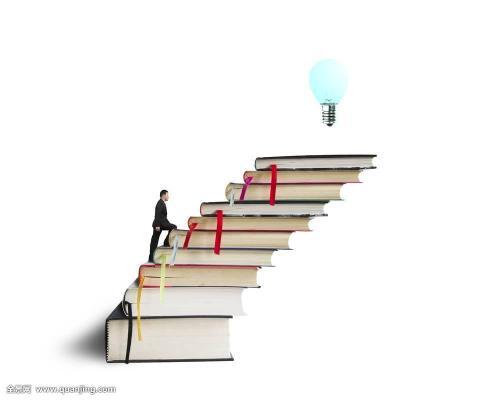
The width and height of the screenshot is (500, 400). In order to click on spine of book in this screenshot , I will do `click(104, 348)`, `click(122, 305)`, `click(138, 274)`, `click(153, 255)`, `click(167, 240)`, `click(189, 220)`, `click(201, 211)`, `click(223, 192)`, `click(244, 175)`, `click(255, 163)`.